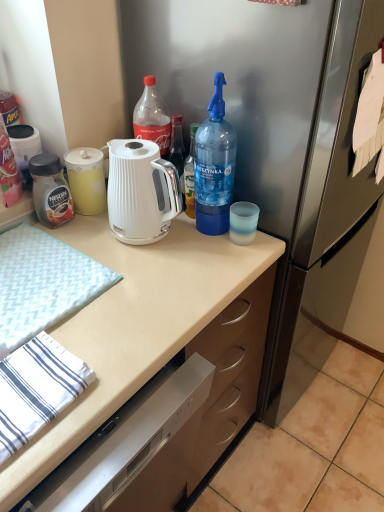
Identify the location of vacant area on top of white matte countertop at center (from a real-world perspective). (148, 247).